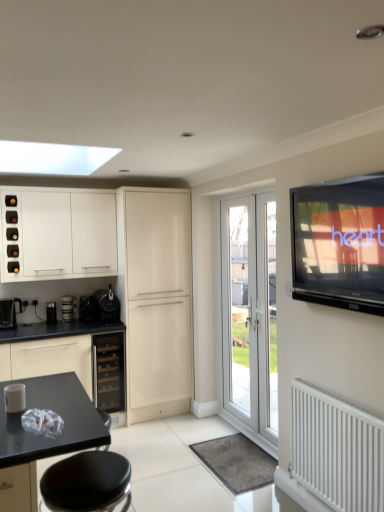
Find the location of a particular element. vacant space underneath flat-screen tv at upper right (from a real-world perspective) is located at coordinates (x=345, y=394).